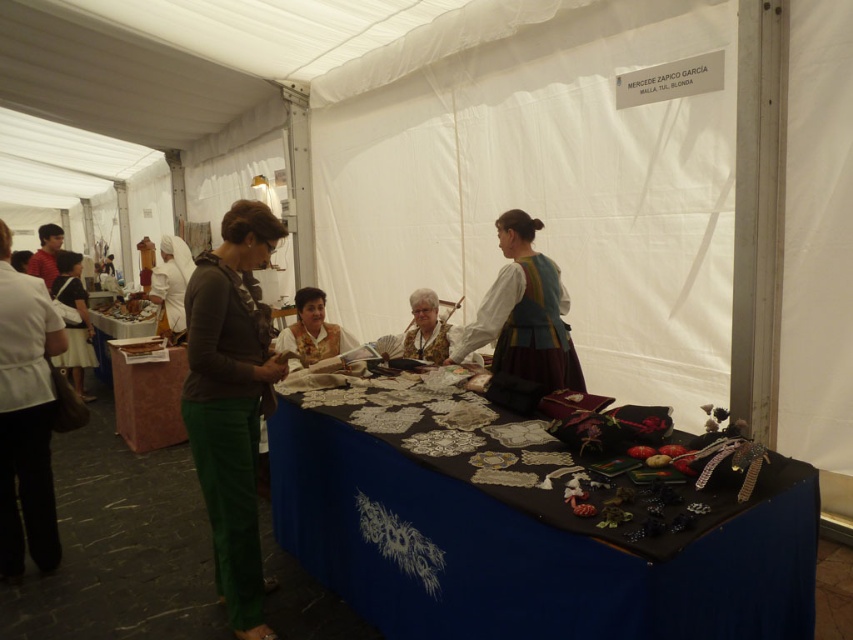
Is point (154, 424) in front of point (434, 346)?

No, (154, 424) is further to viewer.

Is marble table at center smaller than matte white blouse at center?

Actually, marble table at center might be larger than matte white blouse at center.

Is point (143, 408) farther from viewer compared to point (434, 360)?

Yes, it is.

Locate an element on the screen. The width and height of the screenshot is (853, 640). marble table at center is located at coordinates (148, 400).

Can you confirm if embroidered fabric blouse at center is bigger than white silk headscarf at upper left?

No, embroidered fabric blouse at center is not bigger than white silk headscarf at upper left.

Is embroidered fabric blouse at center to the right of white silk headscarf at upper left from the viewer's perspective?

Indeed, embroidered fabric blouse at center is positioned on the right side of white silk headscarf at upper left.

Locate an element on the screen. This screenshot has height=640, width=853. embroidered fabric blouse at center is located at coordinates (312, 330).

Locate an element on the screen. embroidered fabric blouse at center is located at coordinates (312, 330).

Between marble table at center and matte black dress at lower left, which one is positioned lower?

Positioned lower is marble table at center.

Can you confirm if marble table at center is taller than matte black dress at lower left?

No.

Who is more distant from viewer, [141,369] or [56,289]?

Positioned behind is point [56,289].

The height and width of the screenshot is (640, 853). In order to click on marble table at center in this screenshot , I will do `click(148, 400)`.